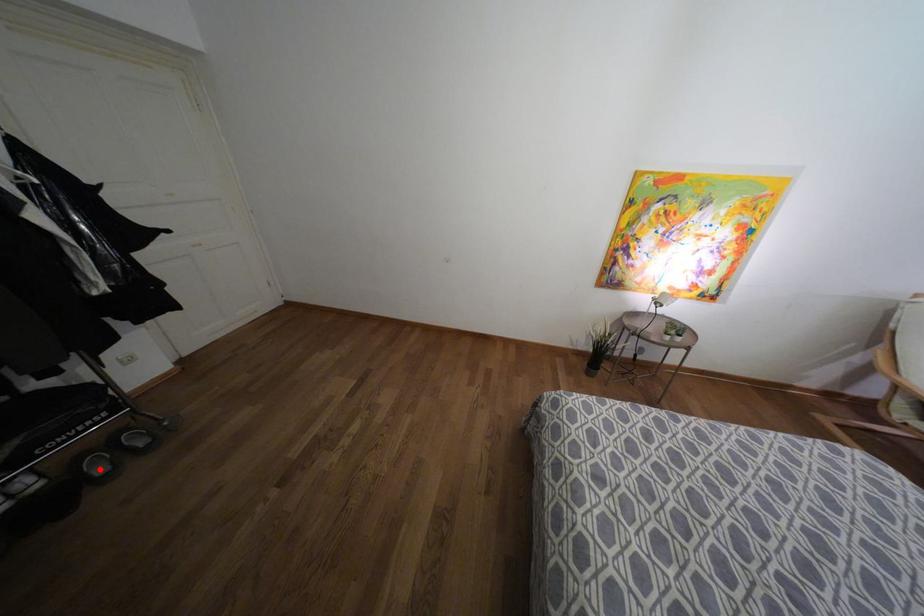
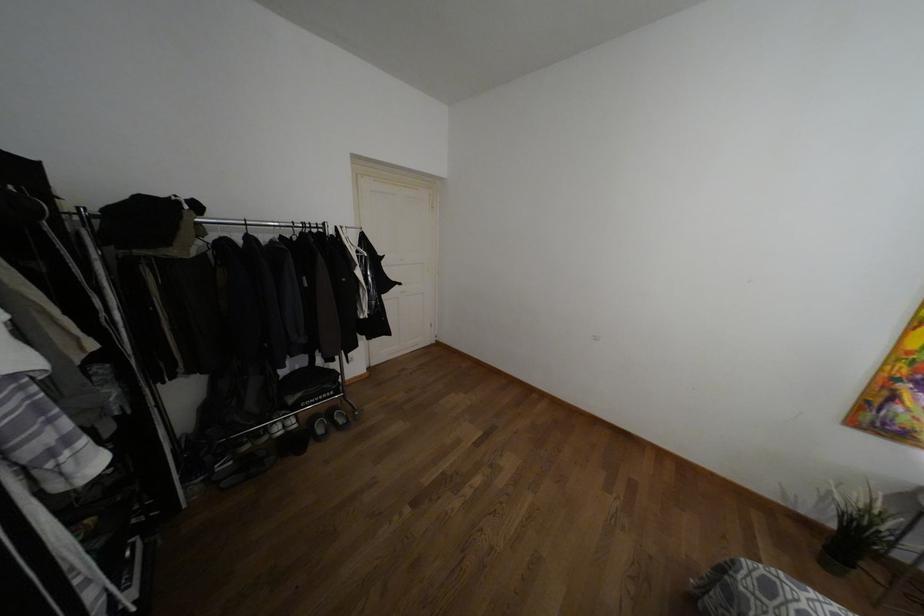
Question: A red point is marked in image1. In image2, is the corresponding 3D point closer to the camera or farther? Reply with the corresponding letter.

Choices:
 (A) The corresponding 3D point is closer.
 (B) The corresponding 3D point is farther.

Answer: (B)